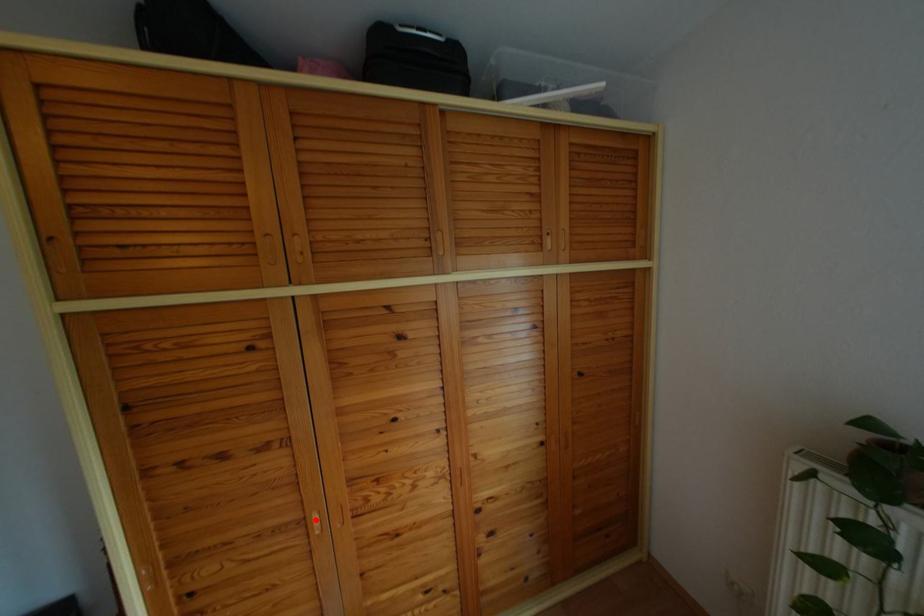
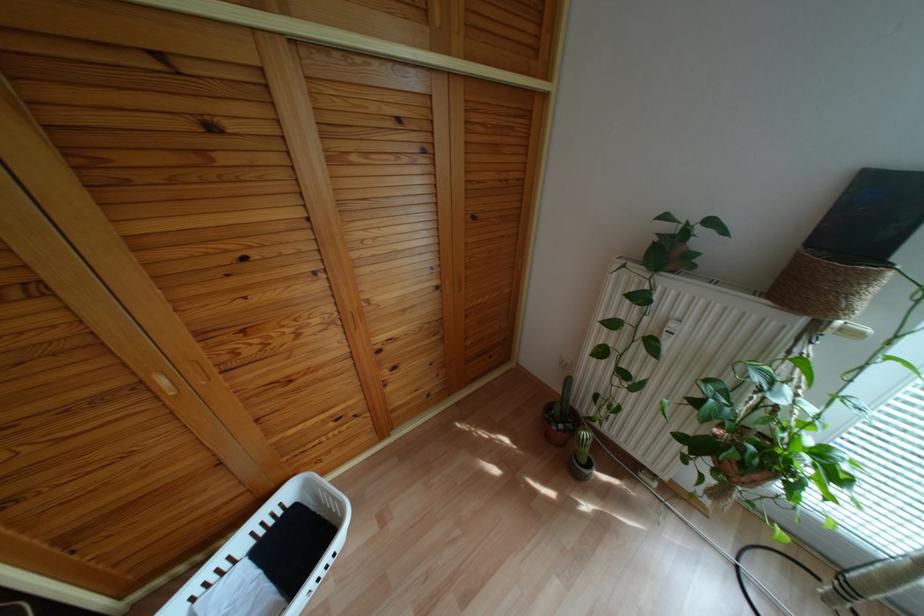
In the second image, find the point that corresponds to the highlighted location in the first image.

(163, 382)